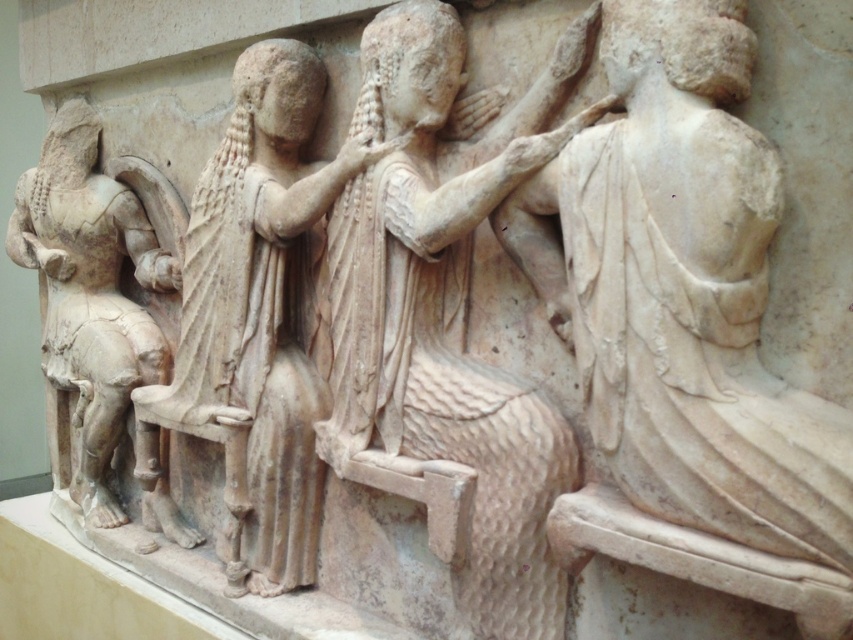
You are an archaeologist examining the relief sculpture. You notice two points marked on the image. The first point is at coordinates point (277, 336) and the second is at point (97, 420). From your perspective, which point is closer to you?

Point (277, 336) is in front of point (97, 420), so it is closer to you.

You are an archaeologist examining the ancient relief sculpture. You notice the white marble draped cloth at right and the matte stone figure at center. Which object is closer to the viewer in the relief?

The white marble draped cloth at right is closer to the viewer because it is positioned in front of the matte stone figure at center.

What is the color and material of the object located at the coordinates point (683,328) in the relief sculpture?

The object at point (683,328) is white marble draped cloth.